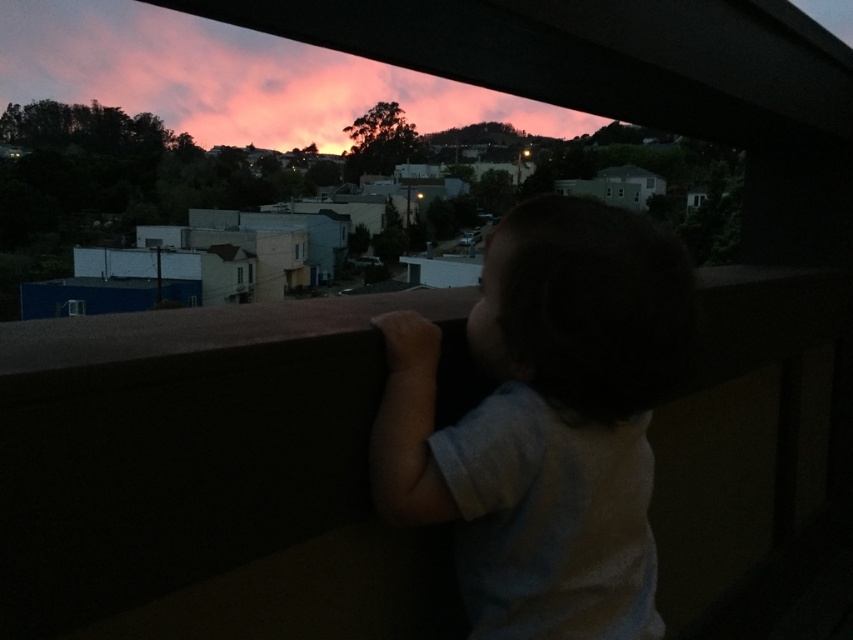
Does white cotton shirt at center have a greater height compared to pink cotton candy clouds at upper center?

In fact, white cotton shirt at center may be shorter than pink cotton candy clouds at upper center.

Is point (527, 323) farther from camera compared to point (68, 68)?

That is False.

Identify the location of white cotton shirt at center. This screenshot has height=640, width=853. (546, 422).